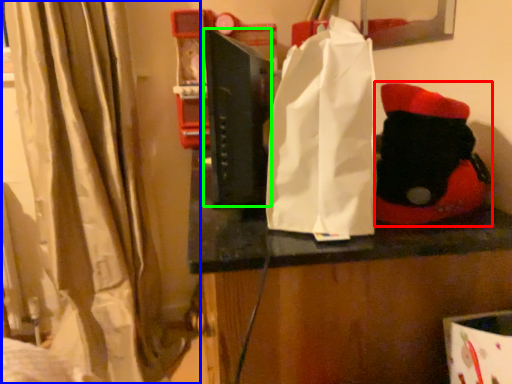
Question: Which object is positioned closest to toy (highlighted by a red box)? Select from curtain (highlighted by a blue box) and book (highlighted by a green box).

Choices:
 (A) curtain
 (B) book

Answer: (B)